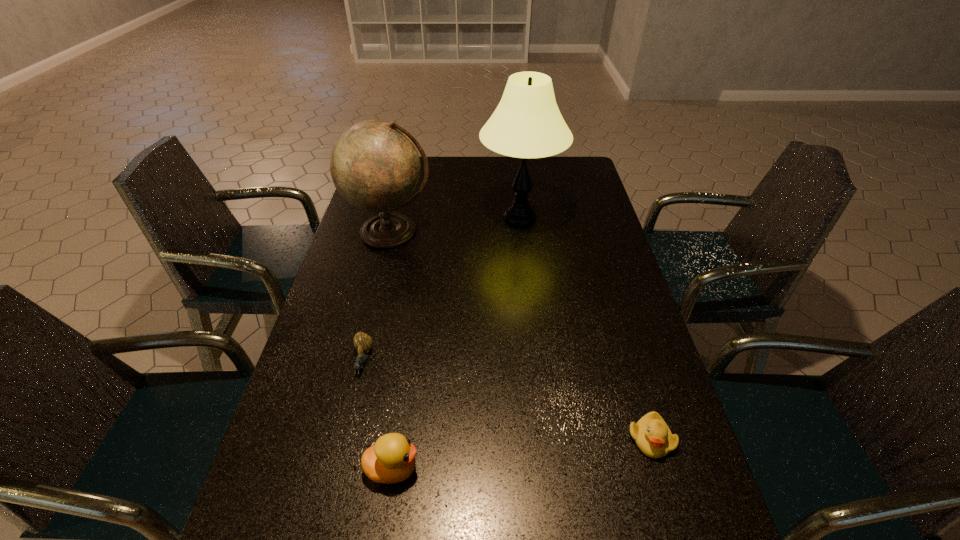
Select which object appears as the fourth closest to the escargot. Please provide its 2D coordinates. Your answer should be formatted as a tuple, i.e. [(x, y)], where the tuple contains the x and y coordinates of a point satisfying the conditions above.

[(652, 435)]

Select which object is the second closest to the third shortest object. Please provide its 2D coordinates. Your answer should be formatted as a tuple, i.e. [(x, y)], where the tuple contains the x and y coordinates of a point satisfying the conditions above.

[(652, 435)]

The image size is (960, 540). I want to click on free space that satisfies the following two spatial constraints: 1. at the face of the rightmost object; 2. on the face of the third shortest object, so pos(660,469).

Locate an element on the screen. vacant point that satisfies the following two spatial constraints: 1. at the face of the right duckling; 2. on the face of the third tallest object is located at coordinates (660, 469).